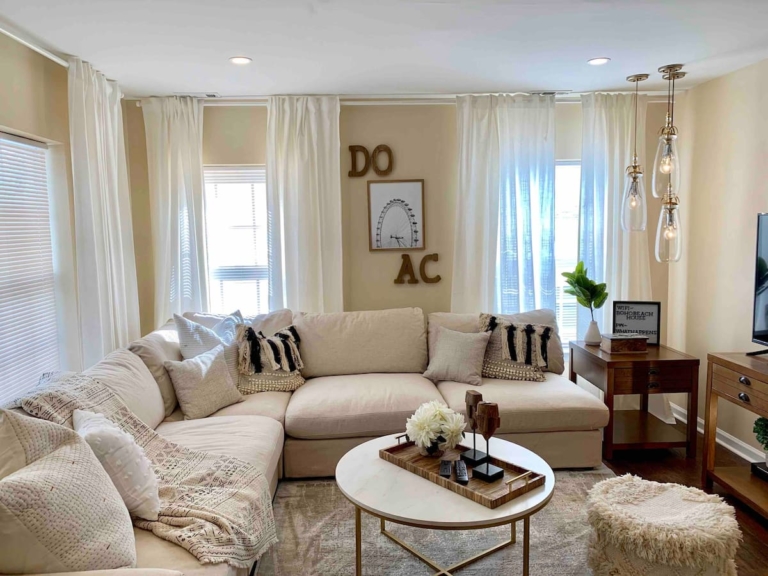
You are a GUI agent. You are given a task and a screenshot of the screen. Output one action in this format:
    pyautogui.click(x=<x>, y=<y>)
    Task: Click on the decoration
    The height and width of the screenshot is (576, 768).
    Given the screenshot: What is the action you would take?
    pyautogui.click(x=392, y=214), pyautogui.click(x=365, y=159), pyautogui.click(x=422, y=265), pyautogui.click(x=591, y=329), pyautogui.click(x=633, y=318), pyautogui.click(x=488, y=502), pyautogui.click(x=484, y=457), pyautogui.click(x=468, y=446), pyautogui.click(x=434, y=430)